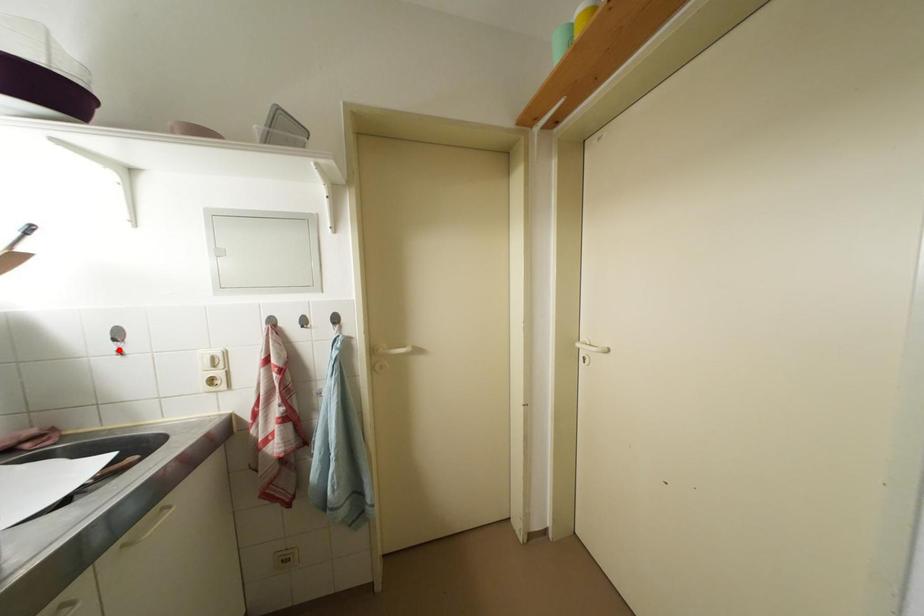
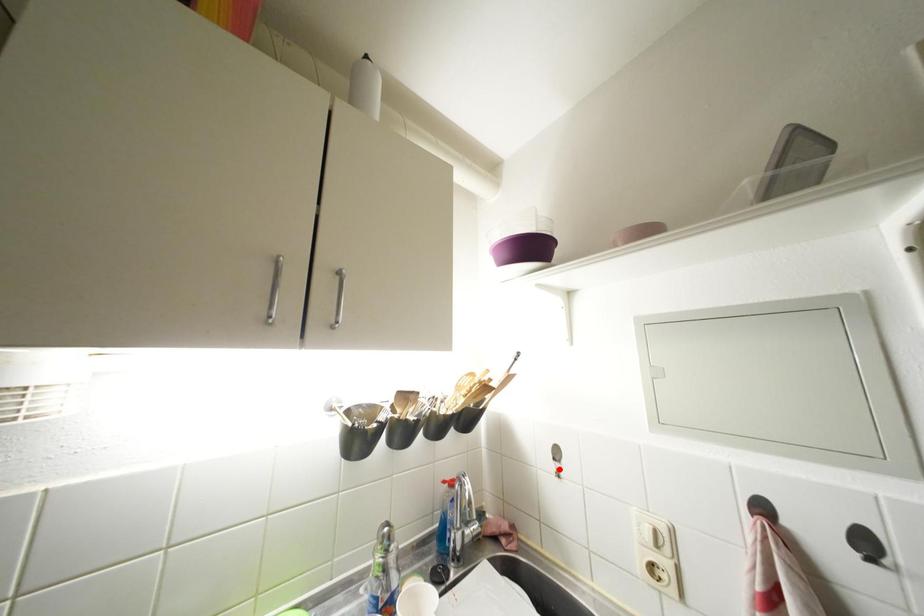
I am providing you with two images of the same scene from different viewpoints. A red point is marked on the first image and another point is marked on the second image. Does the point marked in image1 correspond to the same location as the one in image2?

Yes